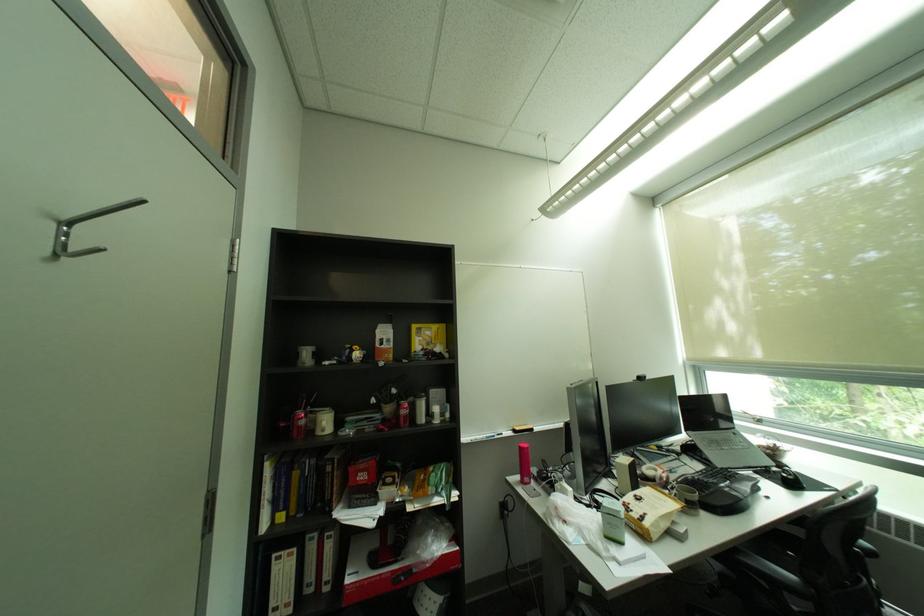
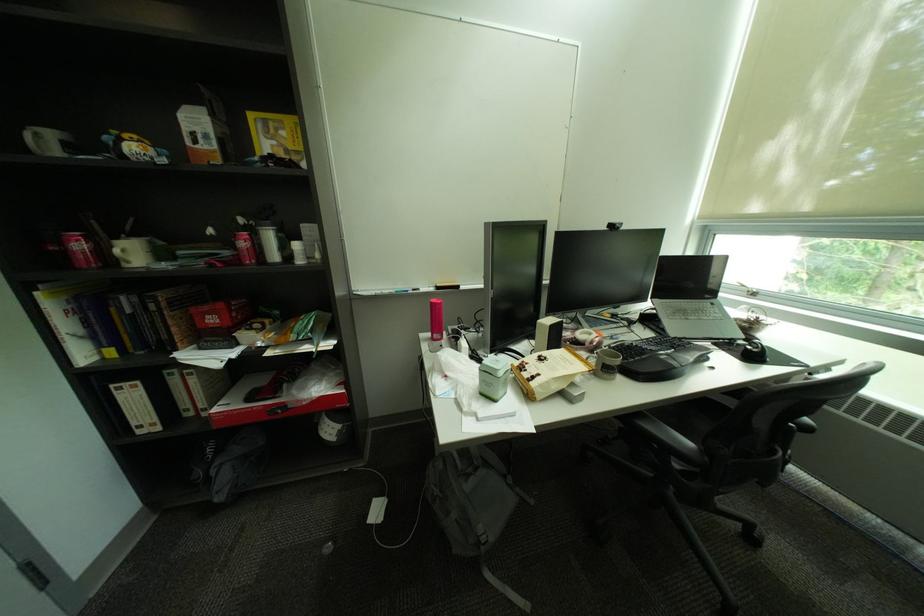
In the second image, find the point that corresponds to point 334,424 in the first image.

(128, 252)